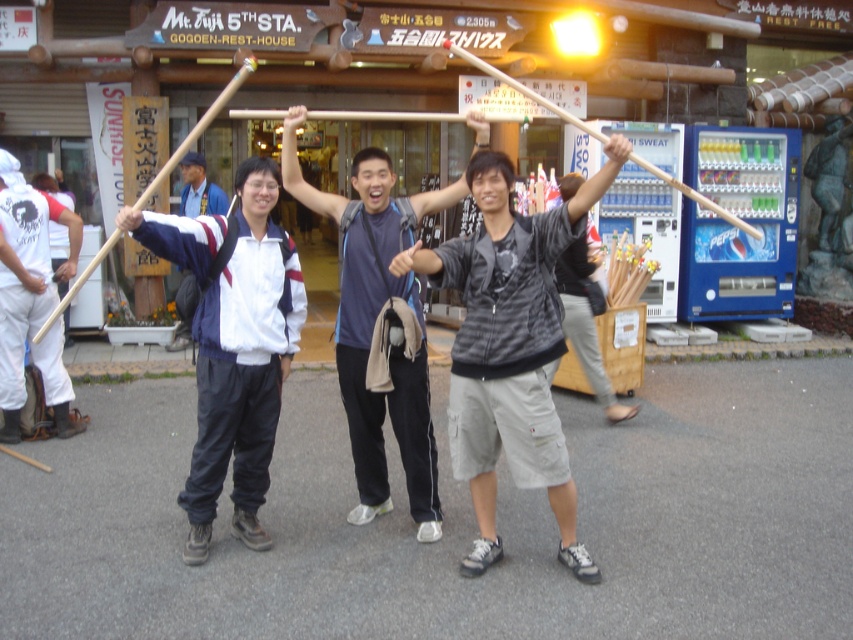
You are a photographer trying to capture a group photo of the tourists. The gray cotton shorts at center and white cotton pants at left are part of their outfits. Based on the scene, which clothing item has a wider leg opening?

The gray cotton shorts at center has a wider leg opening than the white cotton pants at left according to the description.